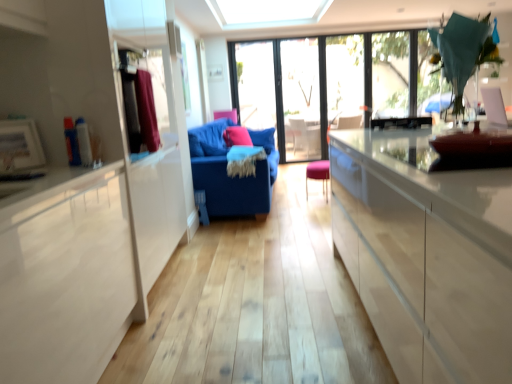
You are a GUI agent. You are given a task and a screenshot of the screen. Output one action in this format:
    pyautogui.click(x=<x>, y=<y>)
    Task: Click on the matte pink pillow at center
    
    Given the screenshot: What is the action you would take?
    [x=237, y=136]

Find the location of a particular element. The width and height of the screenshot is (512, 384). pink fabric stool at center is located at coordinates (318, 173).

The image size is (512, 384). What do you see at coordinates (330, 84) in the screenshot?
I see `transparent glass window at center, the second window in the right-to-left sequence` at bounding box center [330, 84].

Identify the location of transparent glass window at center, the second window in the right-to-left sequence. Image resolution: width=512 pixels, height=384 pixels. (330, 84).

Identify the location of blue fabric couch at center. This screenshot has width=512, height=384. (226, 171).

Describe the element at coordinates (226, 171) in the screenshot. The image size is (512, 384). I see `blue fabric couch at center` at that location.

Locate an element on the screen. This screenshot has width=512, height=384. transparent glass screen door at center is located at coordinates (301, 98).

At what (x,y) coordinates should I click in order to perform the action: click on matte pink pillow at center. Please return your answer as a coordinate pair (x, y). Looking at the image, I should click on (237, 136).

Would you say matte pink pillow at center is a long distance from blue fabric couch at center?

No.

Is point (234, 135) closer or farther from the camera than point (260, 198)?

Point (234, 135) appears to be farther away from the viewer than point (260, 198).

From the picture: Is matte pink pillow at center shorter than blue fabric couch at center?

Yes.

Can you tell me how much matte pink pillow at center and blue fabric couch at center differ in facing direction?

27.7 degrees.

Between matte pink pillow at center and transparent glass screen door at center, which one is positioned in front?

matte pink pillow at center is more forward.

Is matte pink pillow at center to the left of transparent glass screen door at center from the viewer's perspective?

Yes, matte pink pillow at center is to the left of transparent glass screen door at center.

From a real-world perspective, which object stands above the other?

From a 3D spatial view, transparent glass screen door at center is above.

How much distance is there between pink fabric stool at center and transparent glass window at center, the first window viewed from the left?

pink fabric stool at center and transparent glass window at center, the first window viewed from the left, are 1.20 meters apart.

Is pink fabric stool at center wider or thinner than transparent glass window at center, the first window viewed from the left?

Clearly, pink fabric stool at center has more width compared to transparent glass window at center, the first window viewed from the left.

Which is more to the right, pink fabric stool at center or transparent glass window at center, the first window viewed from the left?

transparent glass window at center, the first window viewed from the left, is more to the right.

Considering the positions of points (305, 84) and (346, 103), is point (305, 84) farther from camera compared to point (346, 103)?

Yes, point (305, 84) is behind point (346, 103).

Considering the positions of objects transparent glass screen door at center and transparent glass window at center, the second window in the right-to-left sequence, in the image provided, who is more to the right, transparent glass screen door at center or transparent glass window at center, the second window in the right-to-left sequence,?

transparent glass window at center, the second window in the right-to-left sequence, is more to the right.

Is transparent glass screen door at center not within transparent glass window at center, the first window viewed from the left?

No, transparent glass screen door at center is not entirely external to transparent glass window at center, the first window viewed from the left.

What's the angular difference between pink fabric stool at center and transparent glass window at upper center, placed as the 1th window when sorted from right to left,'s facing directions?

The facing directions of pink fabric stool at center and transparent glass window at upper center, placed as the 1th window when sorted from right to left, are 80 degrees apart.

From the image's perspective, is pink fabric stool at center below transparent glass window at upper center, which is the 2th window in left-to-right order?

Correct, pink fabric stool at center appears lower than transparent glass window at upper center, which is the 2th window in left-to-right order, in the image.

Which object is positioned more to the left, pink fabric stool at center or transparent glass window at upper center, placed as the 1th window when sorted from right to left?

From the viewer's perspective, pink fabric stool at center appears more on the left side.

Is pink fabric stool at center touching transparent glass window at upper center, which is the 2th window in left-to-right order?

No, pink fabric stool at center is not making contact with transparent glass window at upper center, which is the 2th window in left-to-right order.

Considering the relative sizes of pink fabric stool at center and transparent glass screen door at center in the image provided, is pink fabric stool at center wider than transparent glass screen door at center?

Yes, pink fabric stool at center is wider than transparent glass screen door at center.

Is transparent glass screen door at center at the back of pink fabric stool at center?

No.

How many degrees apart are the facing directions of pink fabric stool at center and transparent glass screen door at center?

They differ by 80 degrees in their facing directions.

You are a GUI agent. You are given a task and a screenshot of the screen. Output one action in this format:
    pyautogui.click(x=<x>, y=<y>)
    Task: Click on the screen door above the pink fabric stool at center (from the image's perspective)
    The height and width of the screenshot is (384, 512).
    Given the screenshot: What is the action you would take?
    pyautogui.click(x=301, y=98)

Is matte pink pillow at center looking in the opposite direction of transparent glass window at upper center, which is the 2th window in left-to-right order?

No, matte pink pillow at center's orientation is not away from transparent glass window at upper center, which is the 2th window in left-to-right order.

Does matte pink pillow at center have a smaller size compared to transparent glass window at upper center, placed as the 1th window when sorted from right to left?

Indeed, matte pink pillow at center has a smaller size compared to transparent glass window at upper center, placed as the 1th window when sorted from right to left.

In the scene shown: Can you tell me how much matte pink pillow at center and transparent glass window at upper center, which is the 2th window in left-to-right order, differ in facing direction?

57.9 degrees separate the facing orientations of matte pink pillow at center and transparent glass window at upper center, which is the 2th window in left-to-right order.

Where is `pillow above the blue fabric couch at center (from the image's perspective)`? Image resolution: width=512 pixels, height=384 pixels. pillow above the blue fabric couch at center (from the image's perspective) is located at coordinates (237, 136).

You are a GUI agent. You are given a task and a screenshot of the screen. Output one action in this format:
    pyautogui.click(x=<x>, y=<y>)
    Task: Click on the pillow on the left of transparent glass screen door at center
    The width and height of the screenshot is (512, 384).
    Given the screenshot: What is the action you would take?
    pyautogui.click(x=237, y=136)

From the image, which object appears to be farther from matte pink pillow at center, velvet maroon curtain at left or transparent glass window at upper center, placed as the 1th window when sorted from right to left?

The object further to matte pink pillow at center is velvet maroon curtain at left.

From the image, which object appears to be nearer to blue fabric couch at center, velvet maroon curtain at left or matte pink pillow at center?

matte pink pillow at center.

Looking at the image, which one is located further to matte pink pillow at center, transparent glass window at center, the first window viewed from the left, or transparent glass screen door at center?

transparent glass window at center, the first window viewed from the left, lies further to matte pink pillow at center than the other object.

Consider the image. Considering their positions, is velvet maroon curtain at left positioned closer to transparent glass window at upper center, placed as the 1th window when sorted from right to left, than pink fabric stool at center?

pink fabric stool at center is closer to transparent glass window at upper center, placed as the 1th window when sorted from right to left.

Which object lies further to the anchor point velvet maroon curtain at left, blue fabric couch at center or transparent glass window at upper center, which is the 2th window in left-to-right order?

transparent glass window at upper center, which is the 2th window in left-to-right order.

Considering their positions, is pink fabric stool at center positioned further to blue fabric couch at center than matte pink pillow at center?

pink fabric stool at center is further to blue fabric couch at center.

Which object lies further to the anchor point pink fabric stool at center, transparent glass window at upper center, placed as the 1th window when sorted from right to left, or transparent glass window at center, the second window in the right-to-left sequence?

transparent glass window at center, the second window in the right-to-left sequence, lies further to pink fabric stool at center than the other object.

When comparing their distances from blue fabric couch at center, does matte pink pillow at center or velvet maroon curtain at left seem closer?

matte pink pillow at center lies closer to blue fabric couch at center than the other object.

Where is `window located between matte pink pillow at center and transparent glass window at upper center, placed as the 1th window when sorted from right to left, in the left-right direction`? The width and height of the screenshot is (512, 384). window located between matte pink pillow at center and transparent glass window at upper center, placed as the 1th window when sorted from right to left, in the left-right direction is located at coordinates (330, 84).

Locate an element on the screen. The image size is (512, 384). pillow positioned between blue fabric couch at center and transparent glass screen door at center from near to far is located at coordinates (237, 136).

Locate an element on the screen. This screenshot has height=384, width=512. window situated between transparent glass screen door at center and transparent glass window at upper center, placed as the 1th window when sorted from right to left, from left to right is located at coordinates (330, 84).

This screenshot has height=384, width=512. In order to click on chair positioned between blue fabric couch at center and transparent glass window at center, the second window in the right-to-left sequence, from near to far in this screenshot , I will do `click(318, 173)`.